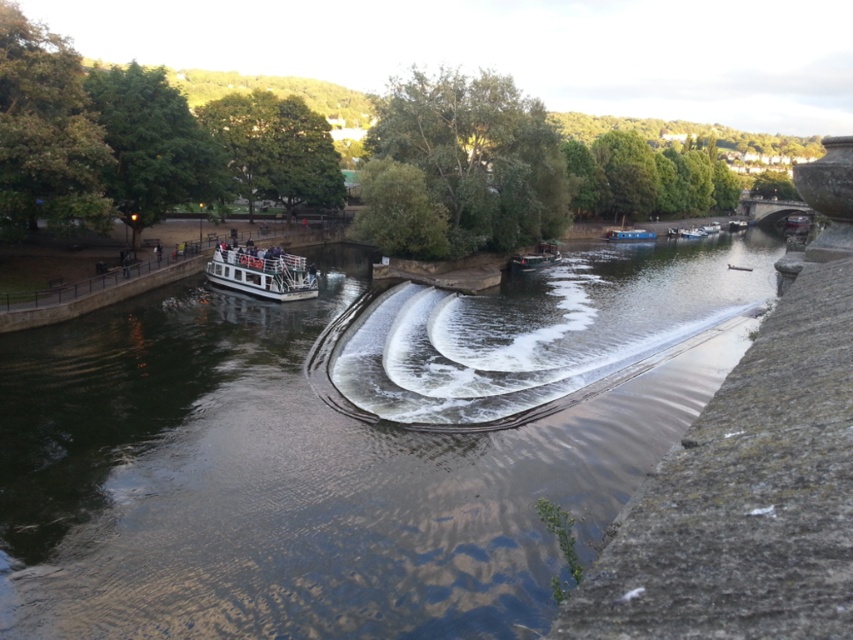
Question: Is wooden boat at center positioned at the back of blue glossy houseboat at center?

Choices:
 (A) no
 (B) yes

Answer: (A)

Question: Which object is farther from the camera taking this photo?

Choices:
 (A) wooden boat at center
 (B) blue glossy houseboat at center

Answer: (B)

Question: Estimate the real-world distances between objects in this image. Which object is closer to the dark green water at center?

Choices:
 (A) white glossy boat at center
 (B) blue glossy houseboat at center

Answer: (A)

Question: Observing the image, what is the correct spatial positioning of dark green water at center in reference to wooden boat at center?

Choices:
 (A) left
 (B) right

Answer: (A)

Question: Among these objects, which one is nearest to the camera?

Choices:
 (A) dark green water at center
 (B) blue glossy houseboat at center
 (C) white glossy boat at center
 (D) wooden boat at center

Answer: (A)

Question: Observing the image, what is the correct spatial positioning of dark green water at center in reference to white glossy boat at center?

Choices:
 (A) right
 (B) left

Answer: (A)